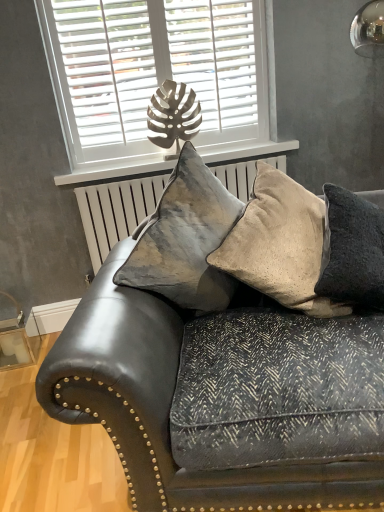
Question: Is white matte window sill at upper center at the back of leather couch at center?

Choices:
 (A) no
 (B) yes

Answer: (B)

Question: Is leather couch at center wider than white matte window sill at upper center?

Choices:
 (A) yes
 (B) no

Answer: (A)

Question: Is leather couch at center shorter than white matte window sill at upper center?

Choices:
 (A) no
 (B) yes

Answer: (A)

Question: Is leather couch at center positioned before white matte window sill at upper center?

Choices:
 (A) no
 (B) yes

Answer: (B)

Question: From the image's perspective, does leather couch at center appear lower than white matte window sill at upper center?

Choices:
 (A) yes
 (B) no

Answer: (A)

Question: Choose the correct answer: Is white matte window at upper center inside beige textured cushion at right, marked as the third pillow in a left-to-right arrangement, or outside it?

Choices:
 (A) inside
 (B) outside

Answer: (B)

Question: From their relative heights in the image, would you say white matte window at upper center is taller or shorter than beige textured cushion at right, which appears as the 1th pillow when viewed from the right?

Choices:
 (A) short
 (B) tall

Answer: (B)

Question: Is white matte window at upper center bigger or smaller than beige textured cushion at right, marked as the third pillow in a left-to-right arrangement?

Choices:
 (A) small
 (B) big

Answer: (A)

Question: From the image's perspective, is white matte window at upper center located above or below beige textured cushion at right, which appears as the 1th pillow when viewed from the right?

Choices:
 (A) above
 (B) below

Answer: (A)

Question: Is point (309, 221) positioned closer to the camera than point (349, 204)?

Choices:
 (A) closer
 (B) farther

Answer: (B)

Question: Based on their positions, is velvet beige pillow at center, the second pillow positioned from the left, located to the left or right of beige textured cushion at right, marked as the third pillow in a left-to-right arrangement?

Choices:
 (A) left
 (B) right

Answer: (A)

Question: Considering the positions of velvet beige pillow at center, which is the second pillow in right-to-left order, and beige textured cushion at right, marked as the third pillow in a left-to-right arrangement, in the image, is velvet beige pillow at center, which is the second pillow in right-to-left order, bigger or smaller than beige textured cushion at right, marked as the third pillow in a left-to-right arrangement,?

Choices:
 (A) small
 (B) big

Answer: (B)

Question: From a real-world perspective, relative to beige textured cushion at right, marked as the third pillow in a left-to-right arrangement, is velvet beige pillow at center, which is the second pillow in right-to-left order, vertically above or below?

Choices:
 (A) below
 (B) above

Answer: (B)

Question: Is point (200, 74) closer or farther from the camera than point (299, 452)?

Choices:
 (A) closer
 (B) farther

Answer: (B)

Question: From a real-world perspective, is white matte window at upper center positioned above or below leather couch at center?

Choices:
 (A) above
 (B) below

Answer: (A)